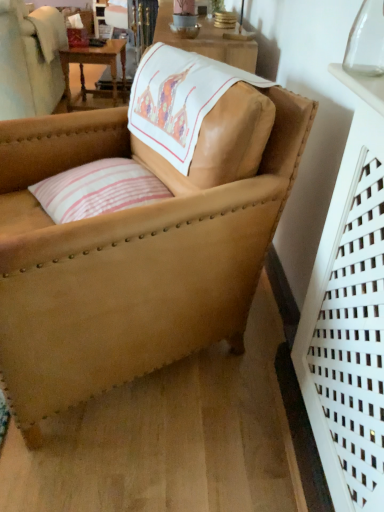
Question: Would you say wooden table at upper left is to the left or to the right of transparent glass vase at upper right in the picture?

Choices:
 (A) left
 (B) right

Answer: (A)

Question: In terms of width, does wooden table at upper left look wider or thinner when compared to transparent glass vase at upper right?

Choices:
 (A) thin
 (B) wide

Answer: (B)

Question: Based on their relative distances, which object is farther from the pink striped fabric pillow at center?

Choices:
 (A) transparent glass vase at upper right
 (B) wooden table at upper left
 (C) leather armchair at center

Answer: (B)

Question: Estimate the real-world distances between objects in this image. Which object is farther from the leather armchair at center?

Choices:
 (A) transparent glass vase at upper right
 (B) pink striped fabric pillow at center
 (C) wooden table at upper left

Answer: (C)